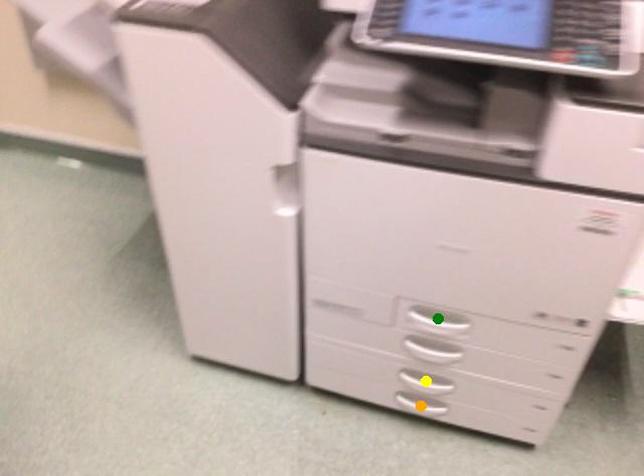
Order these from nearest to farthest:
A) yellow point
B) orange point
C) green point

orange point → yellow point → green point